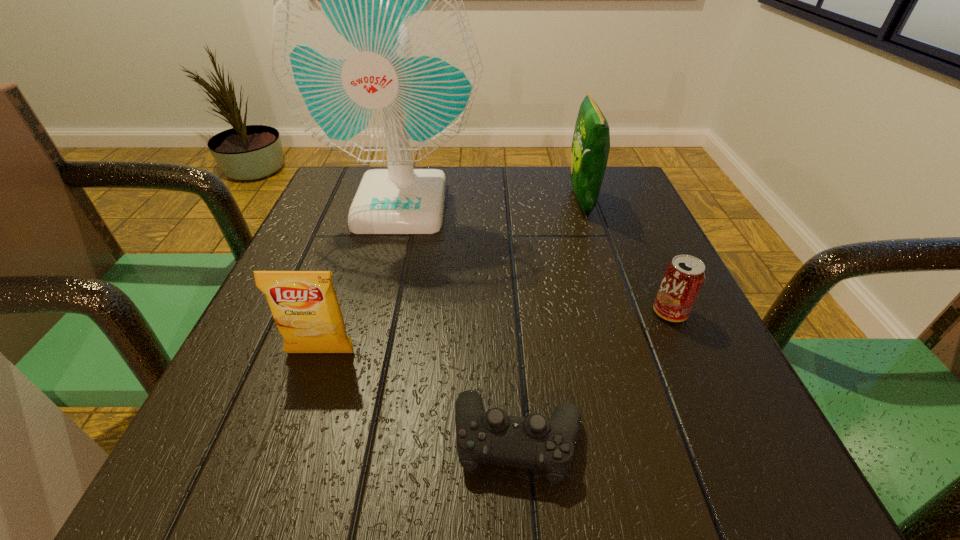
Identify the location of vacant point at the near right corner. The image size is (960, 540). (782, 488).

The height and width of the screenshot is (540, 960). Identify the location of free space between the third nearest object and the left crisp (potato chip). (495, 333).

Identify the location of unoccupied area between the second shortest object and the second object from right to left. Image resolution: width=960 pixels, height=540 pixels. (626, 256).

Where is `vacant area between the rightmost object and the fourth shortest object`? vacant area between the rightmost object and the fourth shortest object is located at coordinates (626, 256).

At what (x,y) coordinates should I click in order to perform the action: click on free space that is in between the second tallest object and the control. Please return your answer as a coordinate pair (x, y). This screenshot has width=960, height=540. Looking at the image, I should click on (550, 320).

Image resolution: width=960 pixels, height=540 pixels. In order to click on free point between the second object from right to left and the tallest object in this screenshot , I will do `click(492, 202)`.

Find the location of `vacant area that lies between the tallest object and the shorter crisp (potato chip)`. vacant area that lies between the tallest object and the shorter crisp (potato chip) is located at coordinates (361, 278).

At what (x,y) coordinates should I click in order to perform the action: click on free spot between the control and the rightmost object. Please return your answer as a coordinate pair (x, y). This screenshot has height=540, width=960. Looking at the image, I should click on (594, 376).

Where is `vacant region between the fourth shortest object and the left crisp (potato chip)`? The width and height of the screenshot is (960, 540). vacant region between the fourth shortest object and the left crisp (potato chip) is located at coordinates (451, 277).

At what (x,y) coordinates should I click in order to perform the action: click on vacant area that lies between the rightmost object and the nearer crisp (potato chip). Please return your answer as a coordinate pair (x, y). The image size is (960, 540). Looking at the image, I should click on (x=495, y=333).